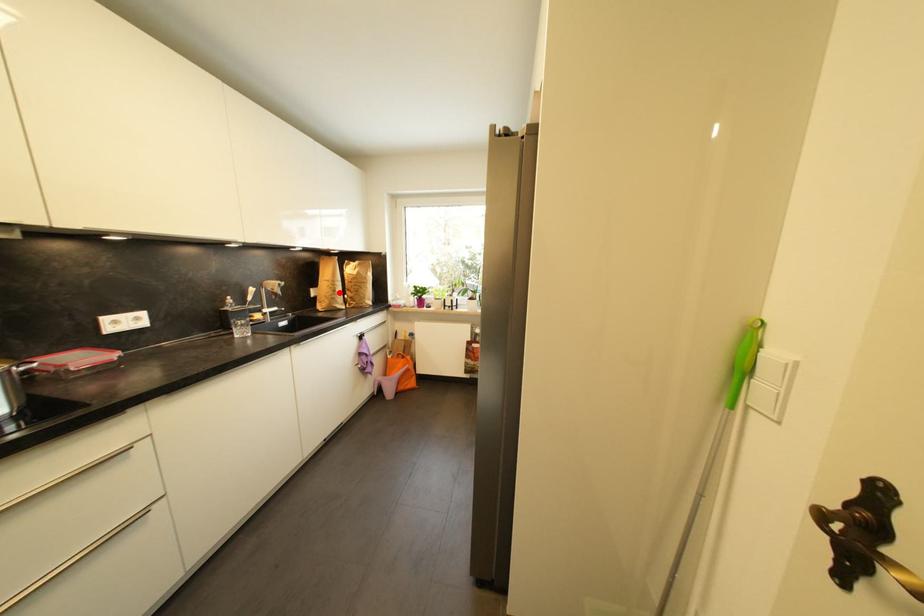
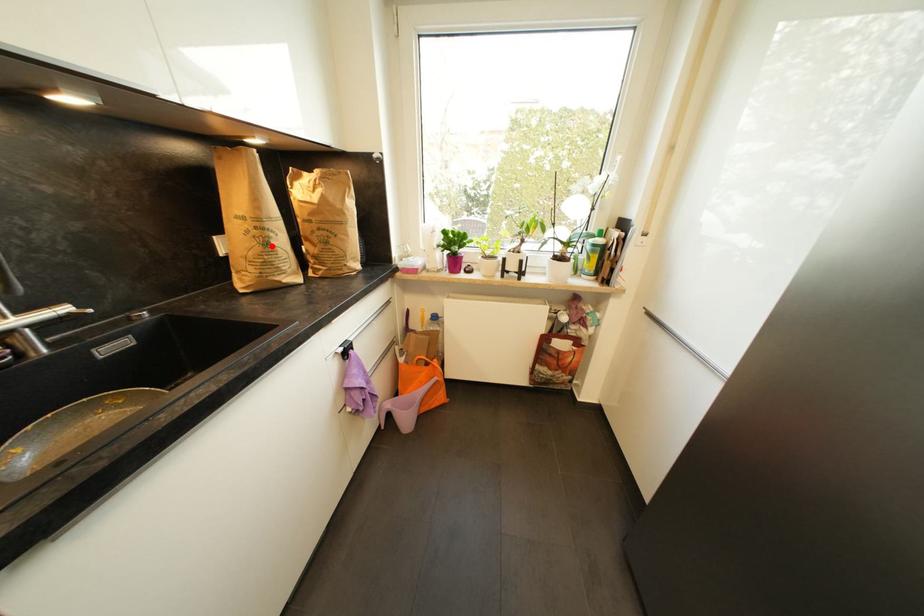
I am providing you with two images of the same scene from different viewpoints. A red point is marked on the first image and another point is marked on the second image. Is the marked point in image1 the same physical position as the marked point in image2?

Yes